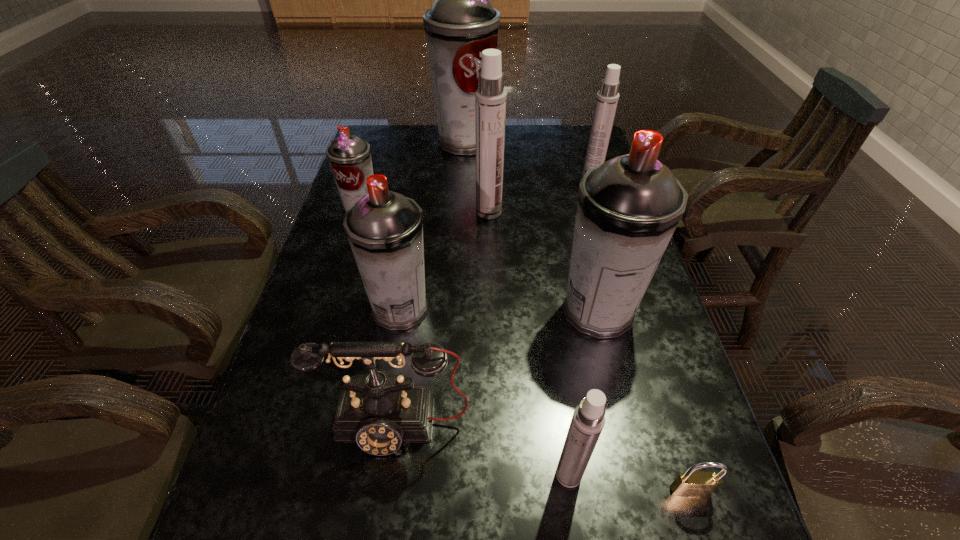
Locate an element on the screen. Image resolution: width=960 pixels, height=540 pixels. vacant space at the far left corner of the desktop is located at coordinates (370, 144).

At what (x,y) coordinates should I click in order to perform the action: click on vacant region at the far right corner of the desktop. Please return your answer as a coordinate pair (x, y). Looking at the image, I should click on (562, 134).

Find the location of a particular element. This screenshot has height=540, width=960. blank region between the second smallest gray aerosol can and the shortest object is located at coordinates (545, 400).

Where is `vacant space that is in between the second smallest gray aerosol can and the nearest aerosol can`? The image size is (960, 540). vacant space that is in between the second smallest gray aerosol can and the nearest aerosol can is located at coordinates (485, 392).

You are a GUI agent. You are given a task and a screenshot of the screen. Output one action in this format:
    pyautogui.click(x=<x>, y=<y>)
    Task: Click on the blank region between the second smallest gray aerosol can and the biggest white aerosol can
    
    Given the screenshot: What is the action you would take?
    pyautogui.click(x=444, y=260)

Locate an element on the screen. This screenshot has height=540, width=960. vacant area between the leftmost aerosol can and the second white aerosol can from right to left is located at coordinates (466, 343).

The image size is (960, 540). Identify the location of empty space that is in between the tallest object and the rightmost gray aerosol can. (532, 227).

Where is `free point between the shortest object and the biggest white aerosol can`? The height and width of the screenshot is (540, 960). free point between the shortest object and the biggest white aerosol can is located at coordinates (589, 351).

This screenshot has height=540, width=960. What are the coordinates of `free area in between the second biggest gray aerosol can and the tallest object` in the screenshot? It's located at (532, 227).

Identify which object is the fourth nearest to the third biggest gray aerosol can. Please provide its 2D coordinates. Your answer should be formatted as a tuple, i.e. [(x, y)], where the tuple contains the x and y coordinates of a point satisfying the conditions above.

[(628, 208)]